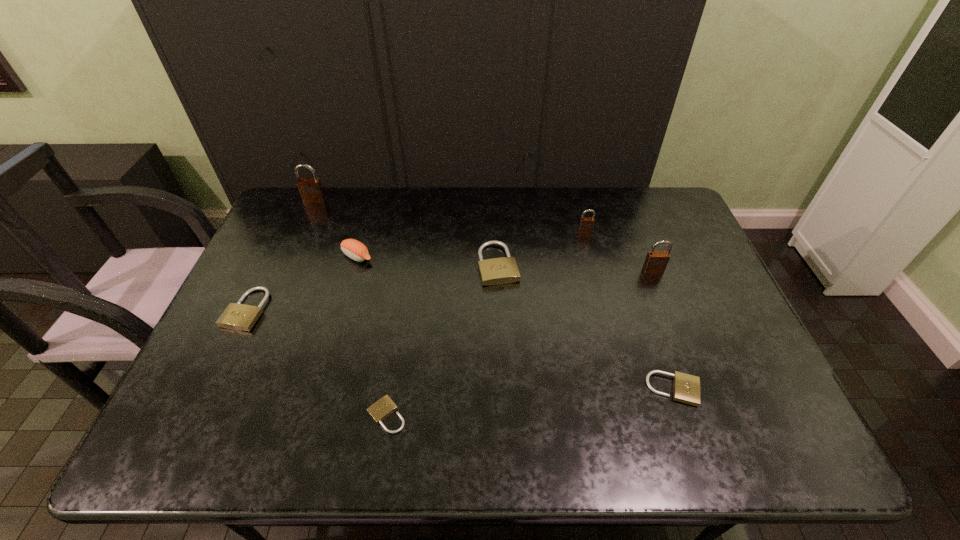
Locate an element on the screen. the sixth farthest object is located at coordinates (237, 316).

Where is `the second farthest beige padlock`? the second farthest beige padlock is located at coordinates (237, 316).

At what (x,y) coordinates should I click in order to perform the action: click on the rightmost beige padlock. Please return your answer as a coordinate pair (x, y). Image resolution: width=960 pixels, height=540 pixels. Looking at the image, I should click on (686, 388).

Where is `the second shortest object`? The width and height of the screenshot is (960, 540). the second shortest object is located at coordinates (686, 388).

At what (x,y) coordinates should I click in order to perform the action: click on the fifth object from right to left. Please return your answer as a coordinate pair (x, y). Image resolution: width=960 pixels, height=540 pixels. Looking at the image, I should click on (381, 409).

Locate an element on the screen. This screenshot has width=960, height=540. the shortest object is located at coordinates (381, 409).

The height and width of the screenshot is (540, 960). What are the coordinates of `free space located on the front-facing side of the farthest brown padlock` in the screenshot? It's located at (305, 221).

Image resolution: width=960 pixels, height=540 pixels. Identify the location of vacant space located on the front-facing side of the rightmost brown padlock. (686, 359).

I want to click on vacant space located on the front-facing side of the second farthest object, so click(x=593, y=266).

Where is `vacant space situated on the front of the fifth shortest object`? vacant space situated on the front of the fifth shortest object is located at coordinates (349, 284).